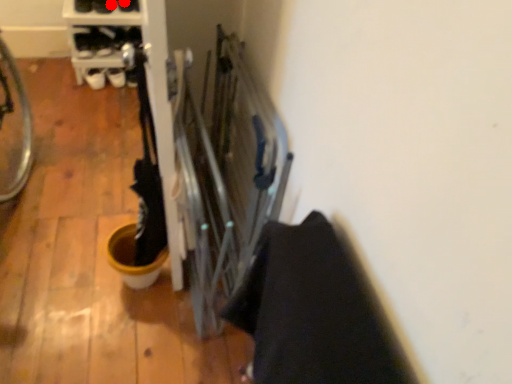
Question: Two points are circled on the image, labeled by A and B beside each circle. Which of the following is the farthest from the observer?

Choices:
 (A) A is further
 (B) B is further

Answer: (B)